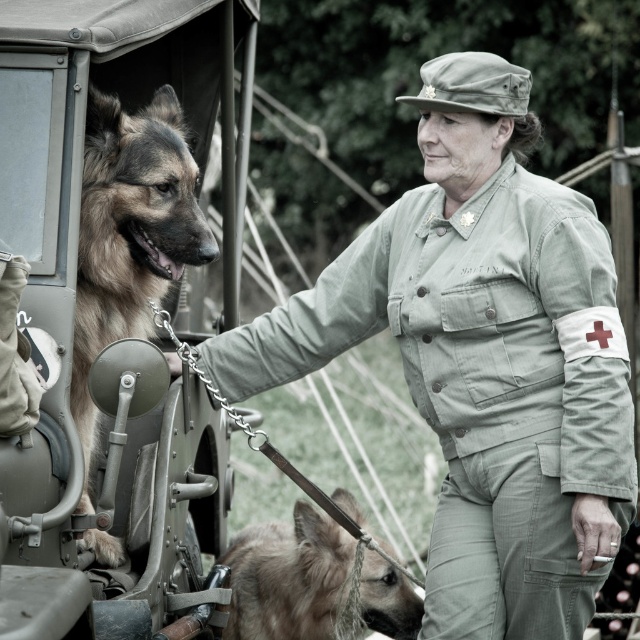
From the picture: You are a photographer trying to capture the scene with a camera positioned at the same level as the two points mentioned. Which point, point (x=472, y=588) or point (x=314, y=515), will appear larger in your photo?

Point (x=472, y=588) will appear larger in the photo because it is closer to the camera than point (x=314, y=515).

You are a military medic in the field and need to secure both dogs for a medical checkup. The brown fur dog at left is on the vehicle and the light brown fur at lower center is on the ground. Which dog should you approach first to ensure you can reach them without climbing?

The light brown fur at lower center is located at lower center and is on the ground, so you should approach the light brown fur at lower center first since it doesn not require climbing to reach.